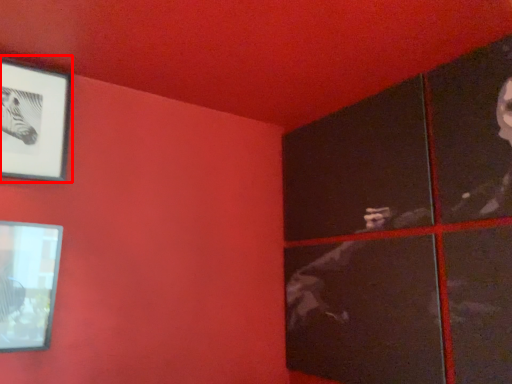
Question: From the image's perspective, what is the correct spatial relationship of picture frame (annotated by the red box) in relation to picture frame?

Choices:
 (A) below
 (B) above

Answer: (B)